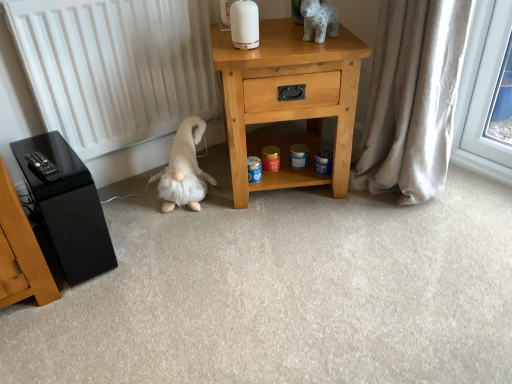
Question: Considering the positions of beige fabric curtain at right and black glossy speaker at left in the image, is beige fabric curtain at right taller or shorter than black glossy speaker at left?

Choices:
 (A) tall
 (B) short

Answer: (A)

Question: Visually, is beige fabric curtain at right positioned to the left or to the right of black glossy speaker at left?

Choices:
 (A) left
 (B) right

Answer: (B)

Question: Estimate the real-world distances between objects in this image. Which object is farther from the fluffy white plush at lower left, placed as the second animal when sorted from right to left?

Choices:
 (A) white matte radiator at left
 (B) beige fabric curtain at right
 (C) white glossy ceramic dog at upper center, which appears as the 1th animal when viewed from the top
 (D) black glossy speaker at left
 (E) light wood nightstand at center

Answer: (B)

Question: Based on their relative distances, which object is nearer to the white glossy ceramic dog at upper center, which appears as the 1th animal when viewed from the top?

Choices:
 (A) fluffy white plush at lower left, placed as the second animal when sorted from right to left
 (B) beige fabric curtain at right
 (C) light wood nightstand at center
 (D) white matte radiator at left
 (E) black glossy speaker at left

Answer: (C)